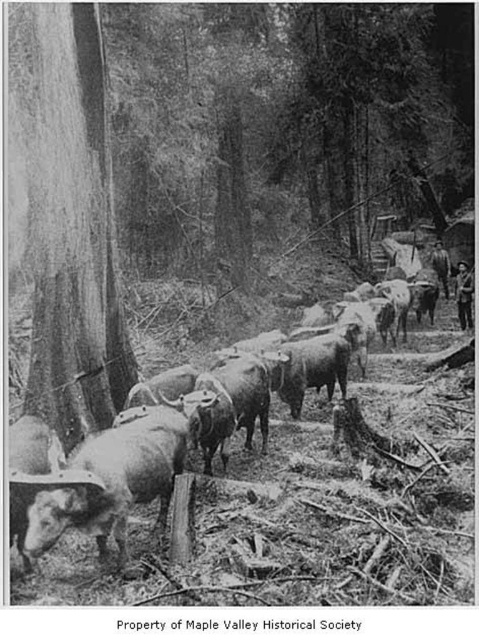
You are a photographer trying to capture a wide shot of the smooth gray cows at center and the smooth bark tree trunk at left. Which object would appear smaller in the photo?

The smooth bark tree trunk at left would appear smaller in the photo because it is smaller than the smooth gray cows at center.

You are standing at the point marked as point (72, 406) in the image. You want to walk towards the herd of cattle in the foreground. How far will you have to walk to reach them?

The distance of point (72, 406) from viewer is 7.00 meters, so you will have to walk 7.00 meters to reach the herd of cattle in the foreground.